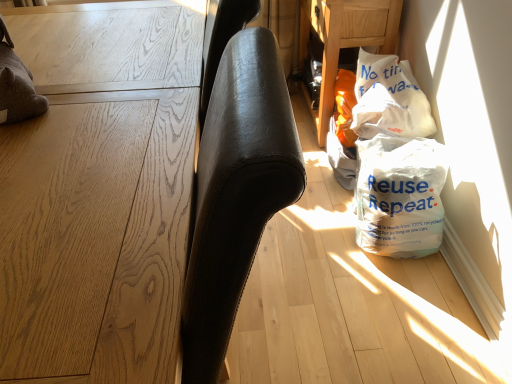
Question: Does white plastic bag at lower right have a larger size compared to white plastic bag at lower right, positioned as the 1th grocery bag in bottom-to-top order?

Choices:
 (A) yes
 (B) no

Answer: (A)

Question: Can you confirm if white plastic bag at lower right is shorter than white plastic bag at lower right, positioned as the 1th grocery bag in bottom-to-top order?

Choices:
 (A) yes
 (B) no

Answer: (B)

Question: Can white plastic bag at lower right, the second grocery bag positioned from the top, be found inside white plastic bag at lower right?

Choices:
 (A) no
 (B) yes

Answer: (A)

Question: From the image's perspective, is white plastic bag at lower right under white plastic bag at lower right, the second grocery bag positioned from the top?

Choices:
 (A) no
 (B) yes

Answer: (A)

Question: Can you confirm if white plastic bag at lower right is smaller than white plastic bag at lower right, the second grocery bag positioned from the top?

Choices:
 (A) yes
 (B) no

Answer: (B)

Question: Is white plastic bag at lower right inside the boundaries of white plastic bag at lower right, the second grocery bag positioned from the top, or outside?

Choices:
 (A) outside
 (B) inside

Answer: (A)

Question: Is white plastic bag at lower right in front of or behind white plastic bag at lower right, positioned as the 1th grocery bag in bottom-to-top order, in the image?

Choices:
 (A) behind
 (B) front

Answer: (A)

Question: From a real-world perspective, is white plastic bag at lower right above or below white plastic bag at lower right, positioned as the 1th grocery bag in bottom-to-top order?

Choices:
 (A) above
 (B) below

Answer: (A)

Question: Is point (308, 24) positioned closer to the camera than point (374, 215)?

Choices:
 (A) farther
 (B) closer

Answer: (A)

Question: Is white plastic bag at lower right wider or thinner than light brown wood table at left?

Choices:
 (A) thin
 (B) wide

Answer: (A)

Question: Is white plastic bag at lower right inside the boundaries of light brown wood table at left, or outside?

Choices:
 (A) inside
 (B) outside

Answer: (B)

Question: In terms of size, does white plastic bag at lower right appear bigger or smaller than light brown wood table at left?

Choices:
 (A) big
 (B) small

Answer: (B)

Question: Is white plastic bag at lower right to the left or to the right of light brown wood table at left in the image?

Choices:
 (A) left
 (B) right

Answer: (B)

Question: Is point (364, 77) positioned closer to the camera than point (110, 364)?

Choices:
 (A) farther
 (B) closer

Answer: (A)

Question: Do you think white plastic bag at upper right, which appears as the first grocery bag when viewed from the top, is within light brown wood table at left, or outside of it?

Choices:
 (A) outside
 (B) inside

Answer: (A)